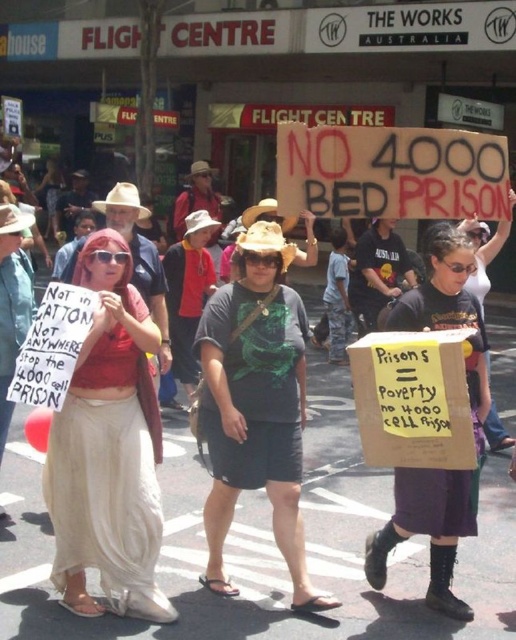
You are a photographer trying to capture the protester in the center of the image. The protester has a white cotton skirt at center and a black cardboard sign at center. Where should you focus your camera to ensure both the skirt and the sign are in the frame?

The white cotton skirt at center is located below the black cardboard sign at center, so you should focus your camera on the area where the black cardboard sign at center is positioned to include both the skirt and the sign in the frame.